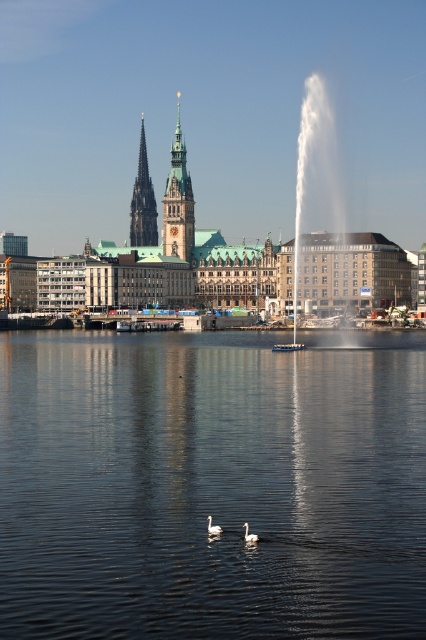
Question: Estimate the real-world distances between objects in this image. Which object is closer to the transparent water at center?

Choices:
 (A) white matte swan at center
 (B) dark brown stone spire at center-left

Answer: (A)

Question: Which object is closer to the camera taking this photo?

Choices:
 (A) green stone tower at center
 (B) dark brown stone spire at center-left

Answer: (A)

Question: Is white frothy water at center bigger than green stone tower at center?

Choices:
 (A) yes
 (B) no

Answer: (A)

Question: Is white matte duck at center wider than white matte swan at center?

Choices:
 (A) yes
 (B) no

Answer: (A)

Question: Which of the following is the farthest from the observer?

Choices:
 (A) tap(176, 118)
 (B) tap(134, 189)

Answer: (B)

Question: Does white frothy water at center appear on the right side of white matte duck at center?

Choices:
 (A) no
 (B) yes

Answer: (B)